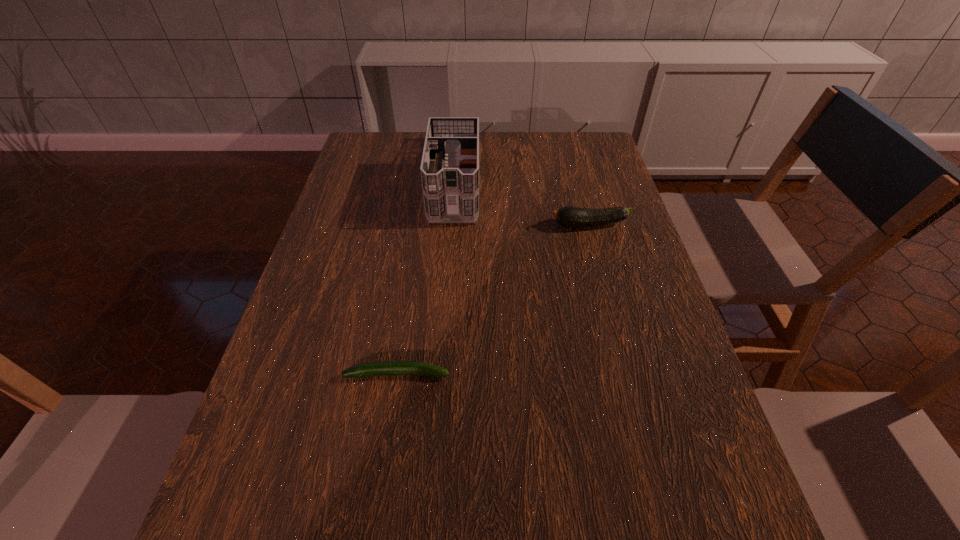
Where is `vacant point that satisfies the following two spatial constraints: 1. at the entrance of the dollhouse; 2. on the front-facing side of the nearest object`? The image size is (960, 540). vacant point that satisfies the following two spatial constraints: 1. at the entrance of the dollhouse; 2. on the front-facing side of the nearest object is located at coordinates (441, 374).